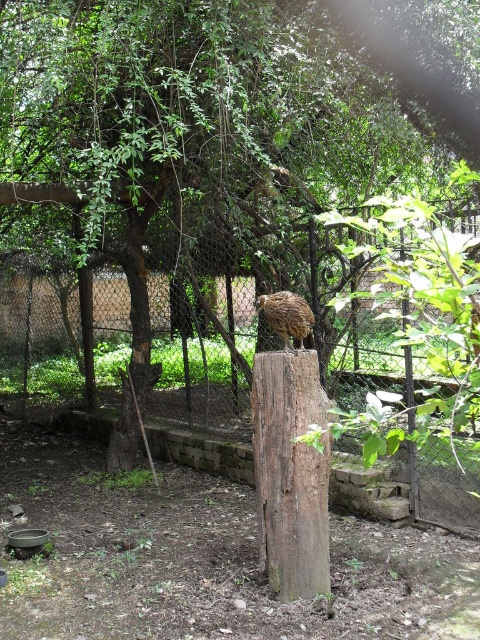
You are a small animal that is 0.5 meters wide. You want to pass between the brown rough wood post at center and the metal mesh fence at center. Can you fit through the space between them?

The brown rough wood post at center and metal mesh fence at center are 1.18 meters apart from each other. Since you are 0.5 meters wide, you can easily fit through the space between them as the distance is more than double your width.

You are a gardener who wants to place a new plant pot between the metal mesh fence at center and the brown feathered bird at center. Based on their positions, where should the pot be placed?

The metal mesh fence at center is located below the brown feathered bird at center, so the plant pot should be placed between them by positioning it above the metal mesh fence at center and below the brown feathered bird at center.

You are standing in the garden and want to reach the metal mesh fence at center. Which direction should you walk from the wooden post to get there?

The metal mesh fence at center is located at point 0.777 on the x and 0.858 on the y coordinate, so you should walk towards the lower right direction from the wooden post to reach it.